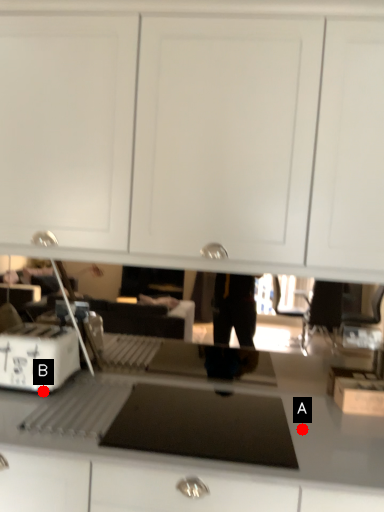
Question: Two points are circled on the image, labeled by A and B beside each circle. Among these points, which one is nearest to the camera?

Choices:
 (A) A is closer
 (B) B is closer

Answer: (A)